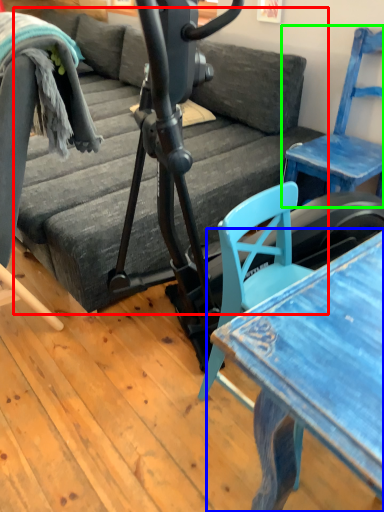
Question: Which object is the closest to the studio couch (highlighted by a red box)? Choose among these: table (highlighted by a blue box) or chair (highlighted by a green box).

Choices:
 (A) table
 (B) chair

Answer: (B)